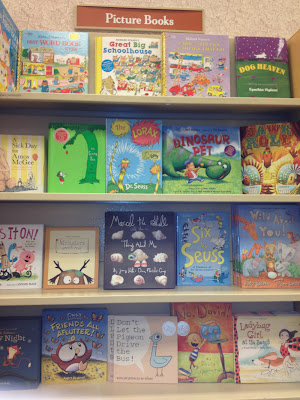
Locate an element on the screen. wall is located at coordinates (243, 16).